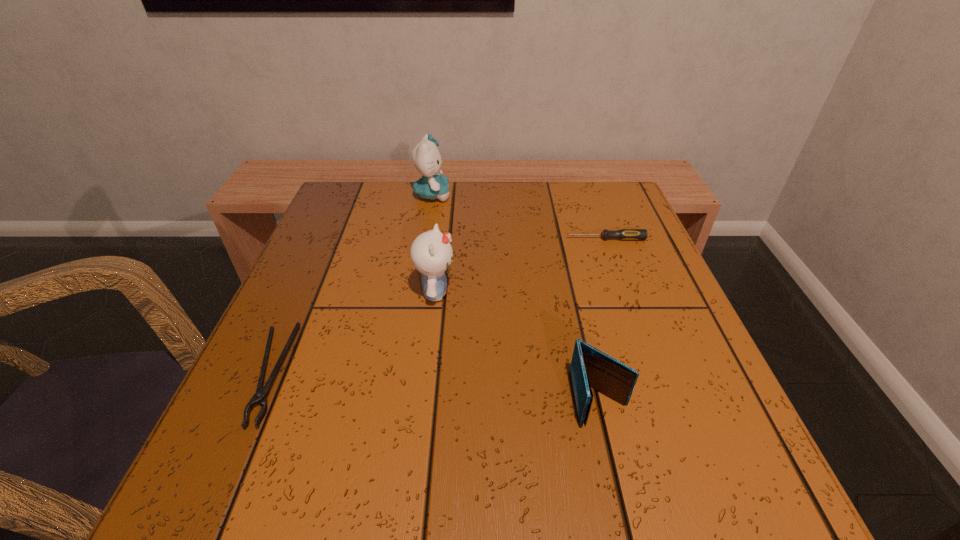
I want to click on the farthest object, so click(433, 185).

The image size is (960, 540). I want to click on the nearer kitten, so click(431, 253).

At what (x,y) coordinates should I click in order to perform the action: click on the third tallest object. Please return your answer as a coordinate pair (x, y). Looking at the image, I should click on (590, 367).

In order to click on screwdriver in this screenshot , I will do `click(624, 234)`.

This screenshot has height=540, width=960. Find the location of `the fourth nearest object`. the fourth nearest object is located at coordinates (624, 234).

At what (x,y) coordinates should I click in order to perform the action: click on tongs. Please return your answer as a coordinate pair (x, y). The image size is (960, 540). Looking at the image, I should click on (260, 397).

Find the location of `the shortest object`. the shortest object is located at coordinates click(x=260, y=397).

The height and width of the screenshot is (540, 960). I want to click on vacant space located on the face of the farthest object, so click(x=552, y=195).

Identify the location of vacant space situated 0.380m on the front-facing side of the third nearest object. (653, 293).

Find the location of a particular element. The width and height of the screenshot is (960, 540). free space located 0.060m on the exterior surface of the wallet is located at coordinates (616, 469).